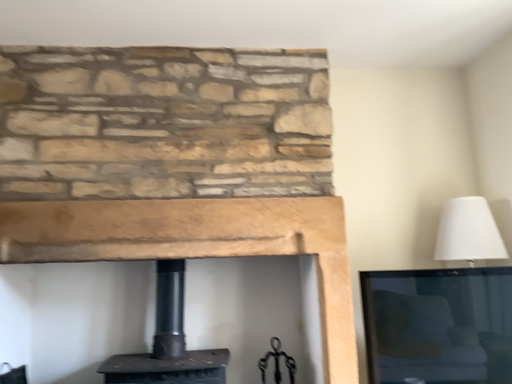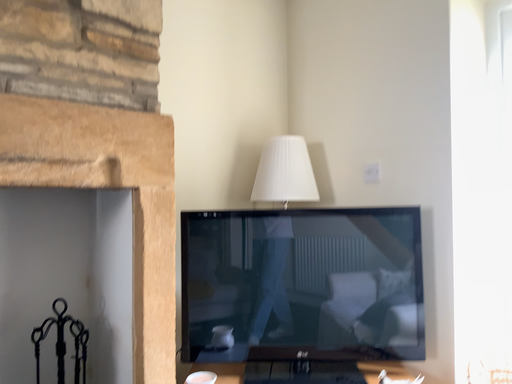
Question: Which way did the camera rotate in the video?

Choices:
 (A) rotated upward
 (B) rotated downward

Answer: (B)